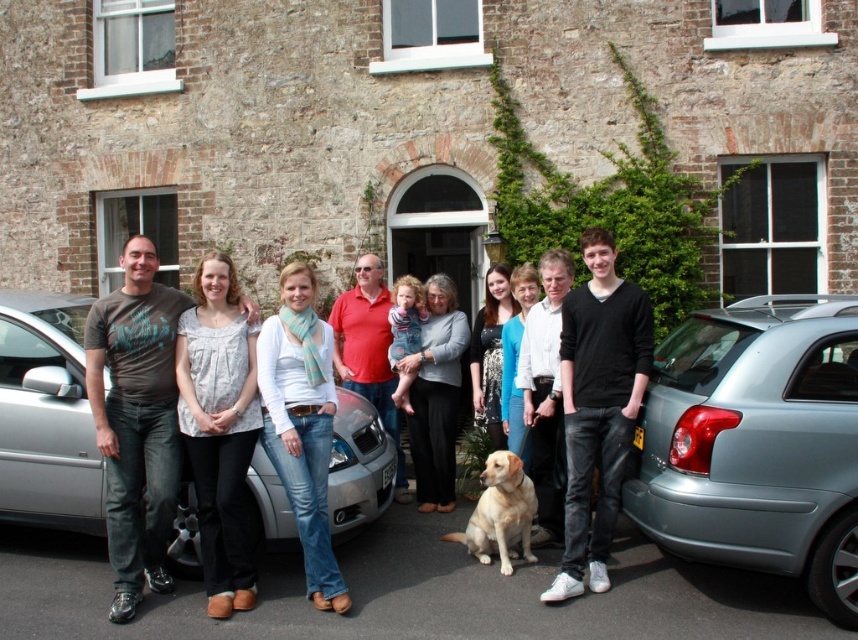
Does metallic gray hatchback at lower right appear over black cotton shirt at center?

Correct, metallic gray hatchback at lower right is located above black cotton shirt at center.

Does metallic gray hatchback at lower right have a larger size compared to black cotton shirt at center?

Correct, metallic gray hatchback at lower right is larger in size than black cotton shirt at center.

Locate an element on the screen. This screenshot has height=640, width=858. metallic gray hatchback at lower right is located at coordinates 757,444.

Who is more forward, (x=605, y=356) or (x=225, y=321)?

Point (x=605, y=356)

Does black cotton shirt at center have a lesser width compared to matte black t-shirt at center?

Indeed, black cotton shirt at center has a lesser width compared to matte black t-shirt at center.

Does point (627, 442) lie in front of point (329, 408)?

Yes, it is.

You are a GUI agent. You are given a task and a screenshot of the screen. Output one action in this format:
    pyautogui.click(x=<x>, y=<y>)
    Task: Click on the black cotton shirt at center
    Image resolution: width=858 pixels, height=640 pixels.
    Given the screenshot: What is the action you would take?
    pyautogui.click(x=597, y=406)

Is metallic gray hatchback at lower right wider than matte gray sweater at center?

Yes.

Consider the image. Which of these two, metallic gray hatchback at lower right or matte gray sweater at center, stands taller?

matte gray sweater at center

Who is more distant from viewer, (702, 532) or (412, 378)?

The point (412, 378) is more distant.

In order to click on metallic gray hatchback at lower right in this screenshot , I will do `click(757, 444)`.